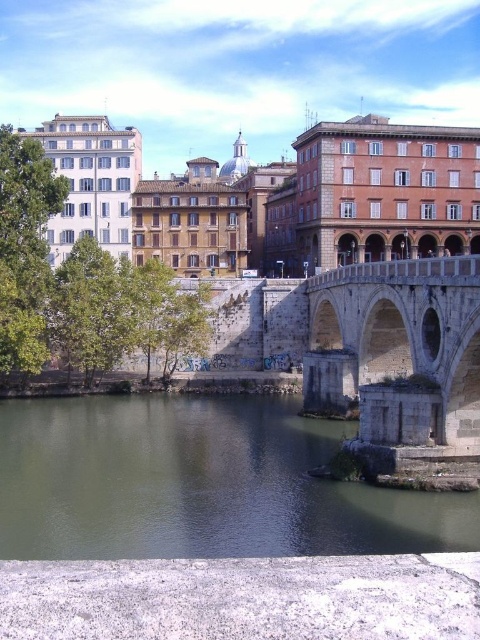
Question: Which point is closer to the camera?

Choices:
 (A) greenish water at lower left
 (B) stone arch bridge at center

Answer: (A)

Question: Is greenish water at lower left thinner than stone arch bridge at center?

Choices:
 (A) yes
 (B) no

Answer: (B)

Question: Is greenish water at lower left smaller than stone arch bridge at center?

Choices:
 (A) yes
 (B) no

Answer: (B)

Question: Which point is closer to the camera?

Choices:
 (A) stone arch bridge at center
 (B) greenish water at lower left

Answer: (B)

Question: Can you confirm if greenish water at lower left is positioned to the left of stone arch bridge at center?

Choices:
 (A) no
 (B) yes

Answer: (B)